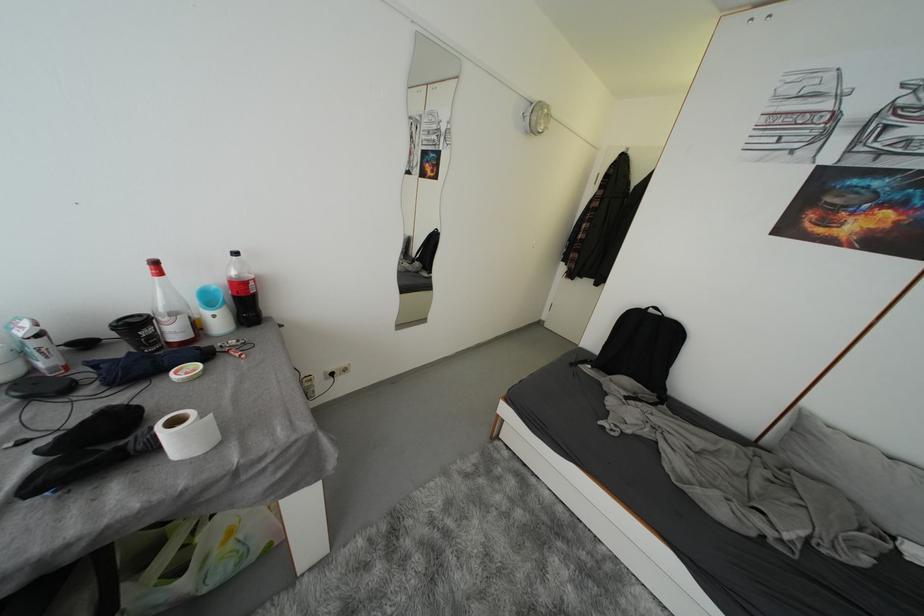
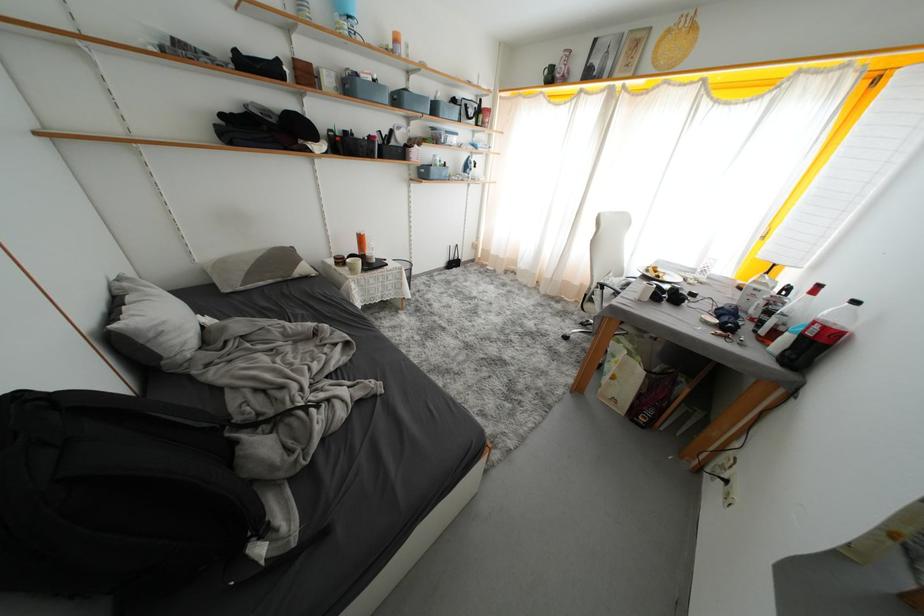
Find the pixel in the second image that matches point 162,342 in the first image.

(767, 328)